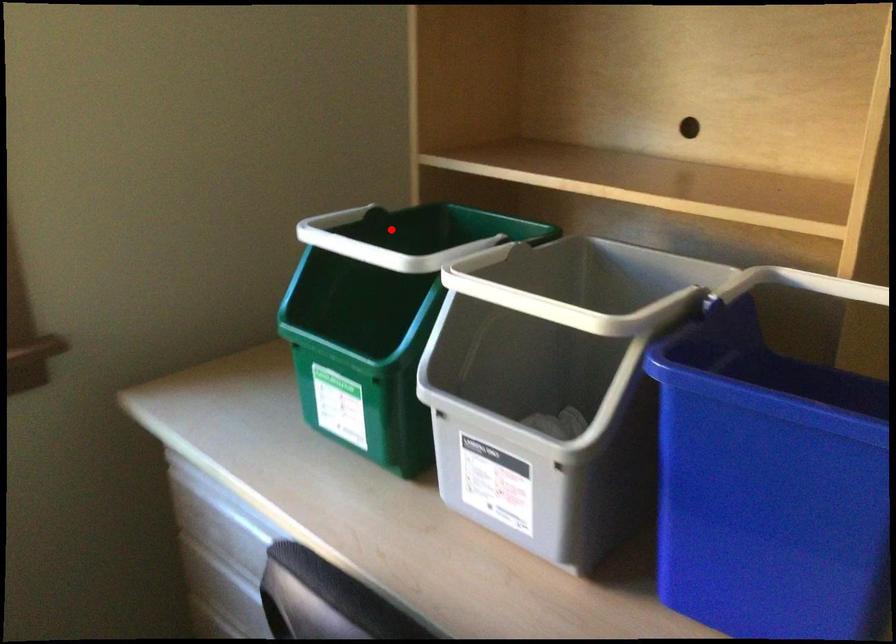
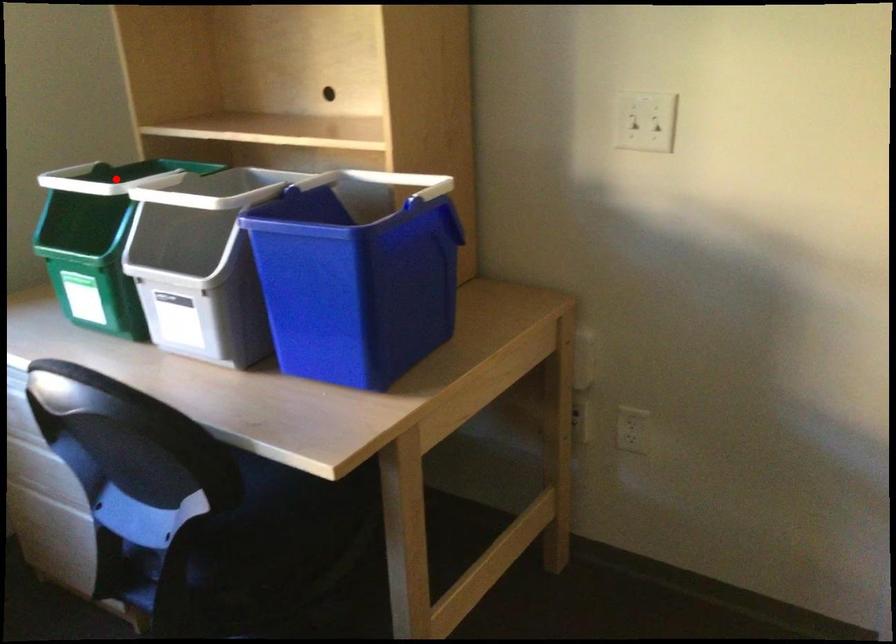
I am providing you with two images of the same scene from different viewpoints. A red point is marked on the first image and another point is marked on the second image. Are the points marked in image1 and image2 representing the same 3D position?

Yes